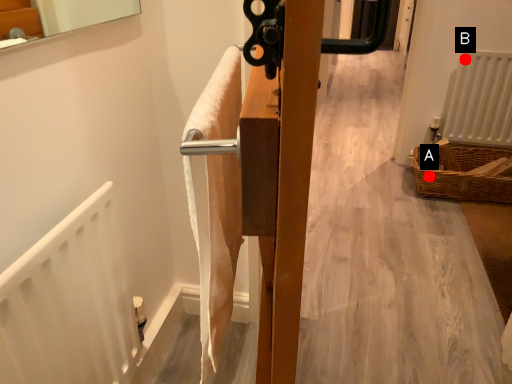
Question: Two points are circled on the image, labeled by A and B beside each circle. Which of the following is the closest to the observer?

Choices:
 (A) A is closer
 (B) B is closer

Answer: (A)